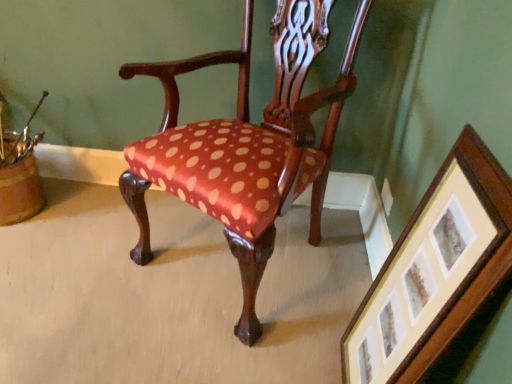
Question: Is wooden picture frame at lower right located outside satin-polka dot chair at center?

Choices:
 (A) yes
 (B) no

Answer: (A)

Question: Is satin-polka dot chair at center at the back of wooden picture frame at lower right?

Choices:
 (A) no
 (B) yes

Answer: (A)

Question: Considering the relative sizes of wooden picture frame at lower right and satin-polka dot chair at center in the image provided, is wooden picture frame at lower right taller than satin-polka dot chair at center?

Choices:
 (A) yes
 (B) no

Answer: (B)

Question: Does wooden picture frame at lower right appear on the right side of satin-polka dot chair at center?

Choices:
 (A) yes
 (B) no

Answer: (A)

Question: Does wooden picture frame at lower right appear on the left side of satin-polka dot chair at center?

Choices:
 (A) no
 (B) yes

Answer: (A)

Question: Is wooden picture frame at lower right smaller than satin-polka dot chair at center?

Choices:
 (A) yes
 (B) no

Answer: (A)

Question: Is satin-polka dot chair at center next to wooden picture frame at lower right and touching it?

Choices:
 (A) no
 (B) yes

Answer: (A)

Question: Is satin-polka dot chair at center looking in the opposite direction of wooden picture frame at lower right?

Choices:
 (A) yes
 (B) no

Answer: (B)

Question: Is satin-polka dot chair at center taller than wooden picture frame at lower right?

Choices:
 (A) yes
 (B) no

Answer: (A)

Question: Is satin-polka dot chair at center positioned before wooden picture frame at lower right?

Choices:
 (A) yes
 (B) no

Answer: (B)

Question: Can you confirm if satin-polka dot chair at center is shorter than wooden picture frame at lower right?

Choices:
 (A) no
 (B) yes

Answer: (A)

Question: Is there a large distance between satin-polka dot chair at center and wooden picture frame at lower right?

Choices:
 (A) no
 (B) yes

Answer: (A)

Question: Considering the positions of wooden picture frame at lower right and satin-polka dot chair at center in the image, is wooden picture frame at lower right taller or shorter than satin-polka dot chair at center?

Choices:
 (A) tall
 (B) short

Answer: (B)